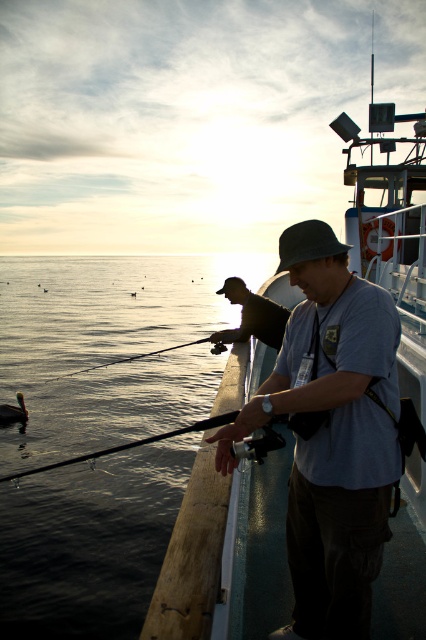
Question: Among these points, which one is nearest to the camera?

Choices:
 (A) (337, 358)
 (B) (150, 353)
 (C) (271, 324)
 (D) (66, 269)

Answer: (A)

Question: Is dark blue water at lower left smaller than brown feathered duck at left?

Choices:
 (A) no
 (B) yes

Answer: (A)

Question: Does gray fabric shirt at center appear on the right side of brown feathered duck at left?

Choices:
 (A) no
 (B) yes

Answer: (B)

Question: Which object appears farthest from the camera in this image?

Choices:
 (A) white wood boat at center
 (B) shiny metallic rod at center
 (C) matte black fishing rod at center

Answer: (B)

Question: Is the position of white wood boat at center less distant than that of brown feathered duck at left?

Choices:
 (A) yes
 (B) no

Answer: (A)

Question: Considering the real-world distances, which object is farthest from the black matte fishing pole at center?

Choices:
 (A) shiny metallic rod at center
 (B) brown feathered duck at left

Answer: (B)